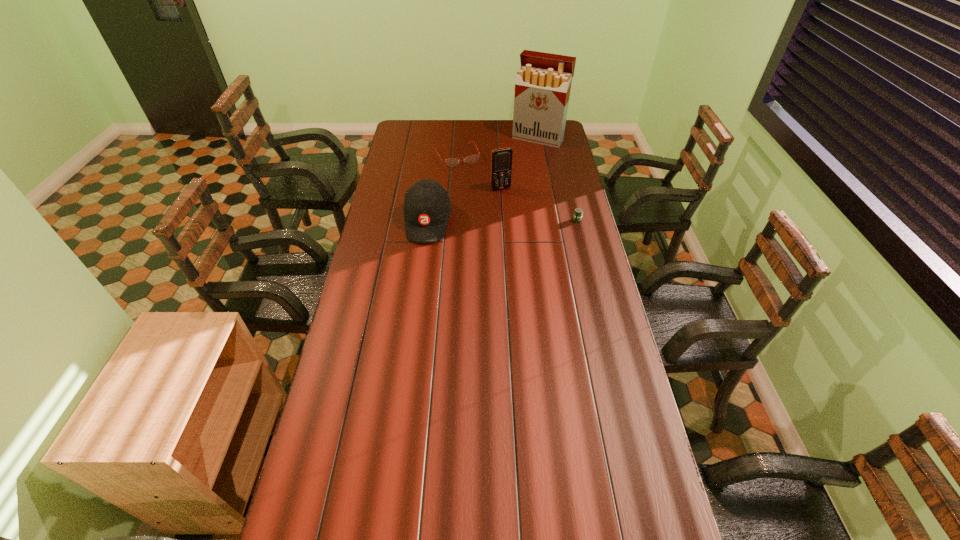
I want to click on blank space located on the lenses of the spectacles, so click(483, 201).

Where is `vacant space located 0.110m on the screen of the fourth shortest object`? vacant space located 0.110m on the screen of the fourth shortest object is located at coordinates (512, 206).

I want to click on vacant point located 0.330m on the screen of the fourth shortest object, so click(531, 237).

Identify the location of vacant space located 0.160m on the screen of the fourth shortest object. (516, 212).

You are a GUI agent. You are given a task and a screenshot of the screen. Output one action in this format:
    pyautogui.click(x=<x>, y=<y>)
    Task: Click on the vacant space located 0.240m with the lid open on the cigarette case
    The image size is (960, 540).
    Given the screenshot: What is the action you would take?
    pyautogui.click(x=515, y=171)

Locate an element on the screen. Image resolution: width=960 pixels, height=540 pixels. vacant space located with the lid open on the cigarette case is located at coordinates [x=519, y=164].

Locate an element on the screen. vacant space located with the lid open on the cigarette case is located at coordinates pos(524,156).

Where is `object that is positioned at the far edge`? Image resolution: width=960 pixels, height=540 pixels. object that is positioned at the far edge is located at coordinates (543, 83).

Locate an element on the screen. Image resolution: width=960 pixels, height=540 pixels. object at the left edge is located at coordinates (427, 207).

In order to click on beer can present at the right edge in this screenshot , I will do `click(578, 212)`.